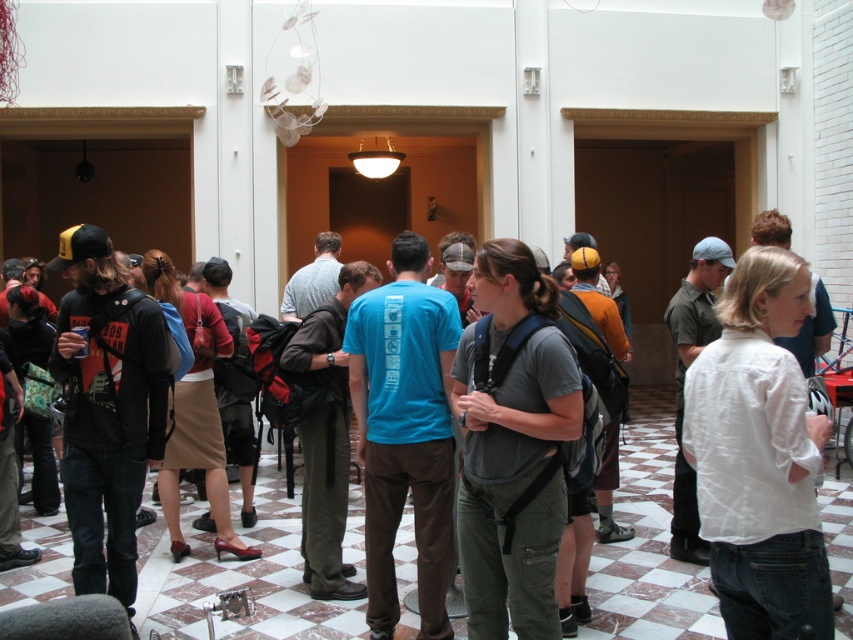
Which is more to the left, black cotton hoodie at left or brown fabric skirt at center?

black cotton hoodie at left

This screenshot has width=853, height=640. In order to click on black cotton hoodie at left in this screenshot , I will do `click(106, 406)`.

Does gray fabric backpack at center have a lesser height compared to blue t-shirt at center?

Yes.

Does gray fabric backpack at center have a greater height compared to blue t-shirt at center?

No.

At what (x,y) coordinates should I click in order to perform the action: click on gray fabric backpack at center. Please return your answer as a coordinate pair (x, y). The height and width of the screenshot is (640, 853). Looking at the image, I should click on (512, 445).

Can you confirm if gray fabric backpack at center is wider than black cotton hoodie at left?

Incorrect, gray fabric backpack at center's width does not surpass black cotton hoodie at left's.

This screenshot has width=853, height=640. Identify the location of gray fabric backpack at center. (512, 445).